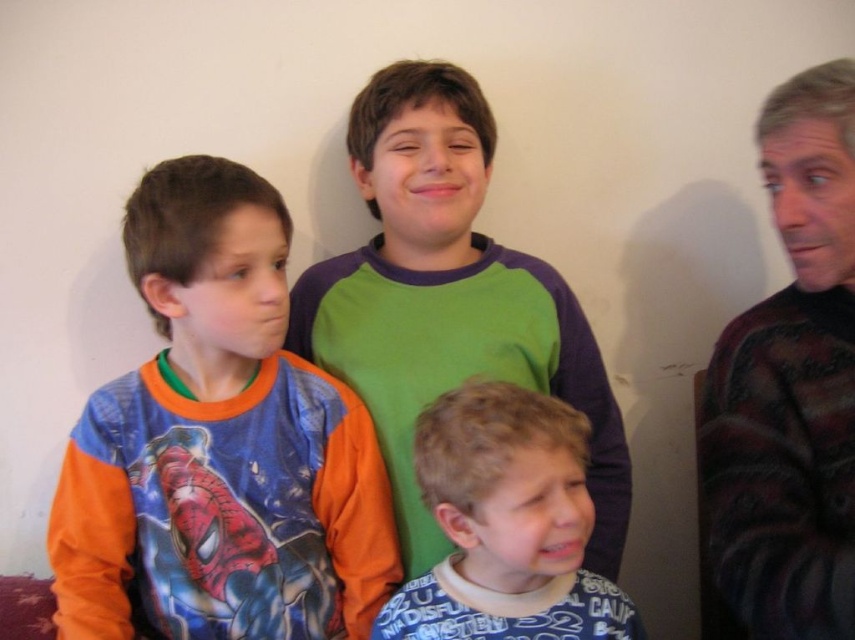
You are organizing a clothing donation drive and need to determine which of the two items takes up more space horizontally. Based on the image, which item is wider between the dark maroon sweater at right and the blue cotton shirt at lower center?

The blue cotton shirt at lower center is wider than the dark maroon sweater at right, so it takes up more horizontal space.

You are standing in front of the image and want to place a sticker exactly at the 2D location of the dark maroon sweater at right. What coordinates should you aim for?

The dark maroun sweater at right is located at coordinates [789,385], so you should aim for those coordinates to place the sticker.